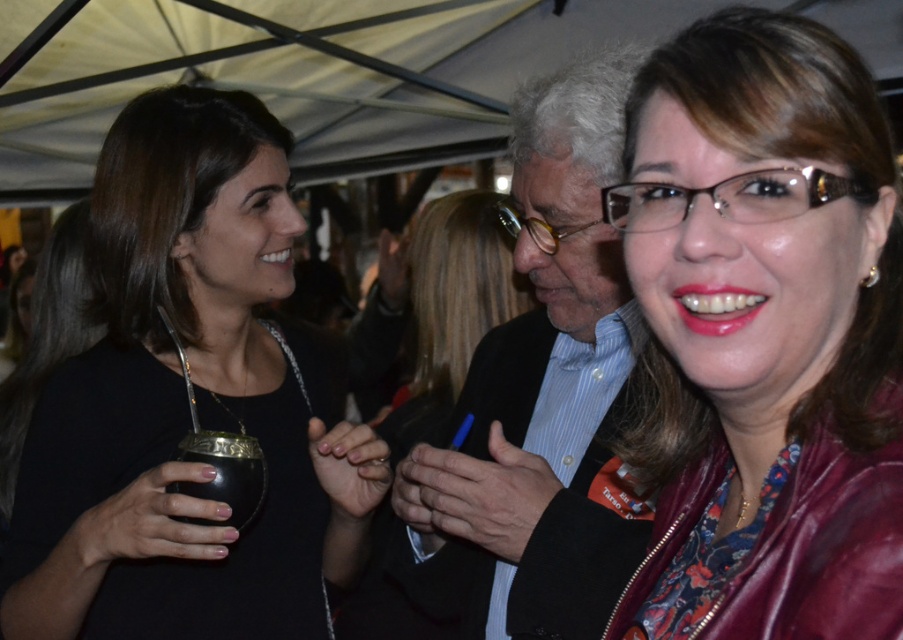
Is point (115, 632) less distant than point (231, 445)?

That is False.

Identify the location of black matte mate cup at left. (188, 403).

The width and height of the screenshot is (903, 640). I want to click on black matte mate cup at left, so [x=188, y=403].

Does matte black suit at center have a larger size compared to black matte mate cup at lower left?

Yes, matte black suit at center is bigger than black matte mate cup at lower left.

Between point (613, 378) and point (238, 440), which one is positioned behind?

Positioned behind is point (613, 378).

Is point (619, 273) behind point (239, 477)?

Yes, point (619, 273) is farther from viewer.

In order to click on matte black suit at center in this screenshot , I will do `click(537, 400)`.

How far apart are matte black jacket at center and matte black suit at center?

matte black jacket at center and matte black suit at center are 11.28 inches apart.

Between matte black jacket at center and matte black suit at center, which one appears on the left side from the viewer's perspective?

matte black suit at center is more to the left.

Who is more forward, (x=846, y=448) or (x=579, y=232)?

Point (x=846, y=448)

Find the location of `matte black jacket at center`. matte black jacket at center is located at coordinates (766, 333).